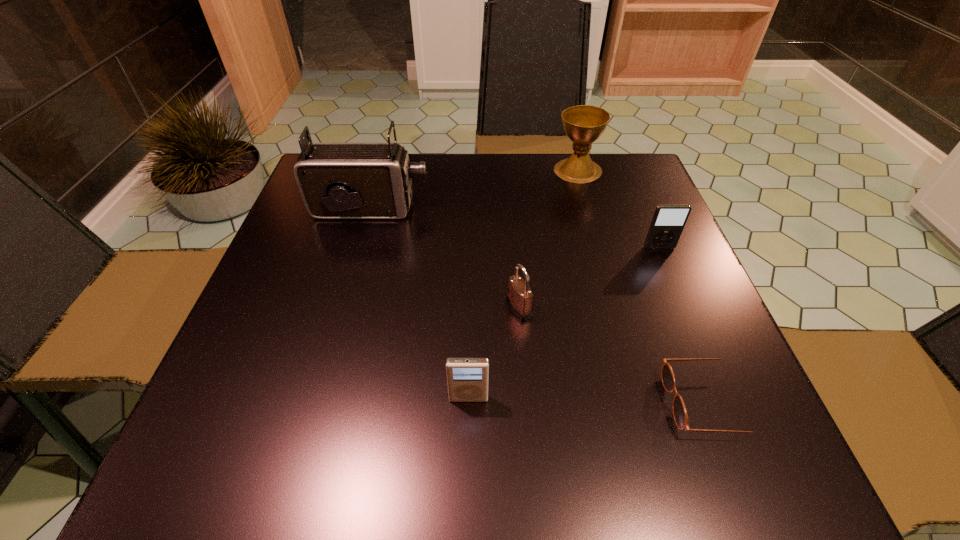
Locate an element on the screen. Image resolution: width=960 pixels, height=540 pixels. the leftmost object is located at coordinates [x=336, y=180].

I want to click on the tallest object, so click(336, 180).

Where is `the second tallest object`? The width and height of the screenshot is (960, 540). the second tallest object is located at coordinates pyautogui.click(x=584, y=124).

Find the location of a particular element. chalice is located at coordinates (584, 124).

Where is `the farther iPod`? the farther iPod is located at coordinates (668, 222).

Identify the location of the right iPod. This screenshot has height=540, width=960. (668, 222).

Identify the location of the fourth farthest object. (519, 297).

The image size is (960, 540). What are the coordinates of `the fourth object from right to left` in the screenshot? It's located at (519, 297).

Where is `the nearer iPod`? The image size is (960, 540). the nearer iPod is located at coordinates (467, 378).

You are a GUI agent. You are given a task and a screenshot of the screen. Output one action in this format:
    pyautogui.click(x=<x>, y=<y>)
    Task: Click on the left iPod
    The image size is (960, 540).
    Given the screenshot: What is the action you would take?
    467,378